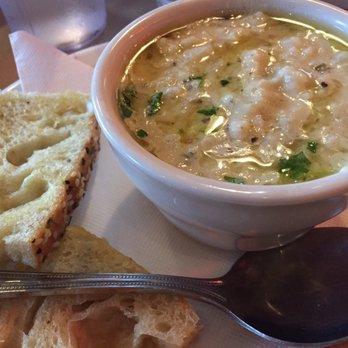
The width and height of the screenshot is (348, 348). Identify the location of spoon. (176, 286).